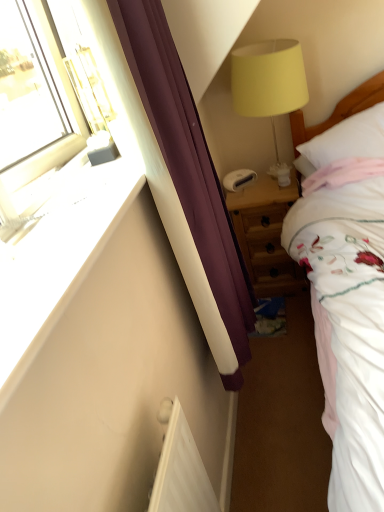
Image resolution: width=384 pixels, height=512 pixels. What are the coordinates of `vacant region above white smooth wall at left (from a real-world perspective)` in the screenshot? It's located at (70, 214).